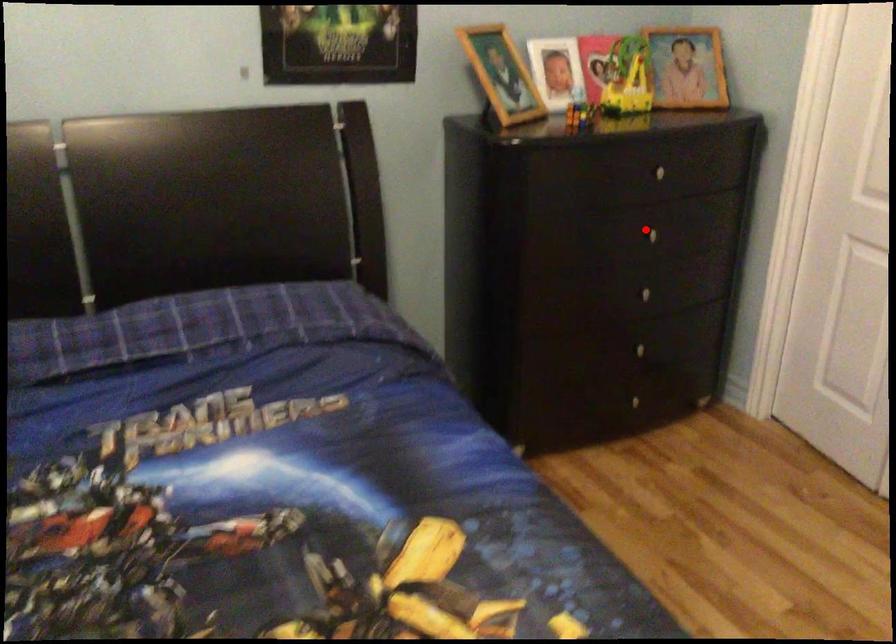
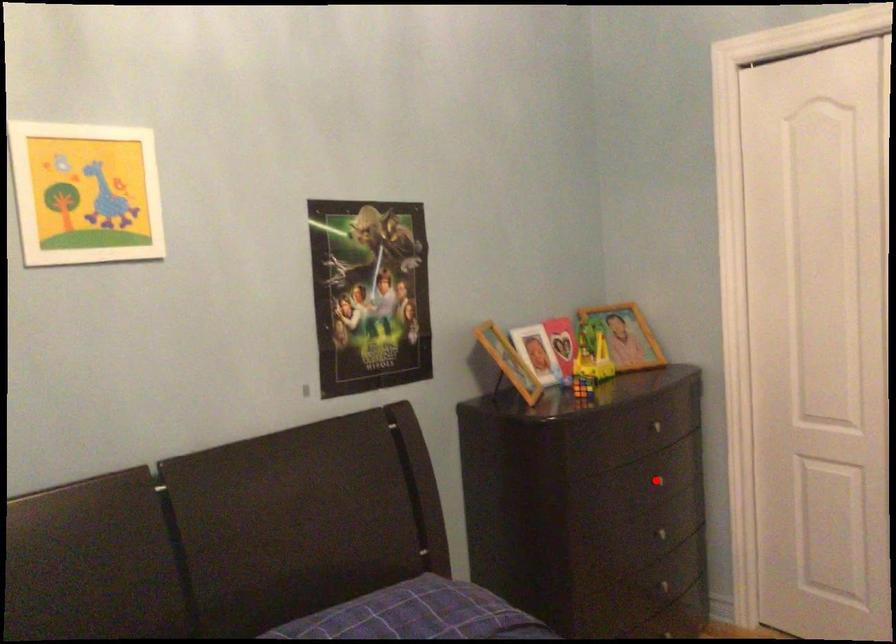
I am providing you with two images of the same scene from different viewpoints. A red point is marked on the first image and another point is marked on the second image. Does the point marked in image1 correspond to the same location as the one in image2?

Yes